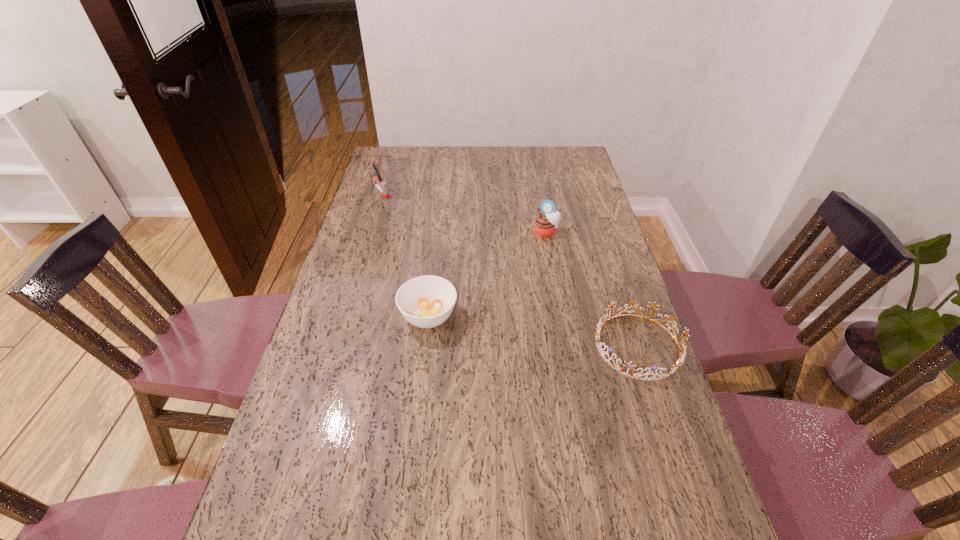
Where is `vacant space situated 0.210m on the front-facing side of the tallest object`? vacant space situated 0.210m on the front-facing side of the tallest object is located at coordinates (534, 278).

The height and width of the screenshot is (540, 960). In order to click on free location located on the front-facing side of the tallest object in this screenshot , I will do `click(541, 248)`.

Image resolution: width=960 pixels, height=540 pixels. What are the coordinates of `vacant space located on the front-facing side of the tallest object` in the screenshot? It's located at (538, 262).

This screenshot has width=960, height=540. I want to click on free point located on the handle side of the farthest object, so click(395, 207).

Where is `vacant space located 0.260m on the handle side of the farthest object`? Image resolution: width=960 pixels, height=540 pixels. vacant space located 0.260m on the handle side of the farthest object is located at coordinates (418, 231).

Locate an element on the screen. vacant space located on the handle side of the farthest object is located at coordinates (433, 247).

Where is `object that is at the left edge`? The height and width of the screenshot is (540, 960). object that is at the left edge is located at coordinates (381, 185).

This screenshot has height=540, width=960. Find the location of `object that is positioned at the right edge`. object that is positioned at the right edge is located at coordinates pos(680,360).

In the image, there is a desktop. What are the coordinates of `vacant space at the far edge` in the screenshot? It's located at (442, 173).

I want to click on vacant space at the left edge, so click(379, 211).